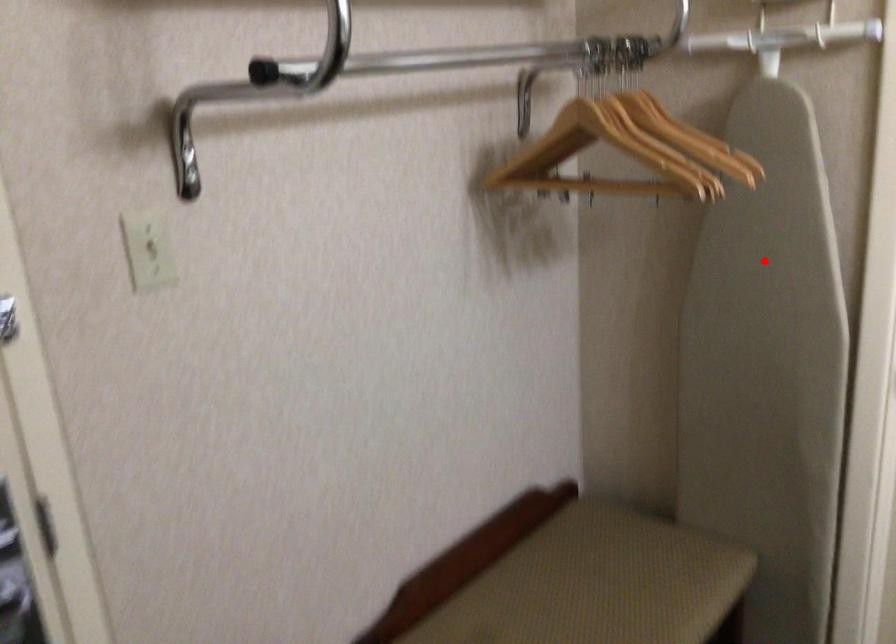
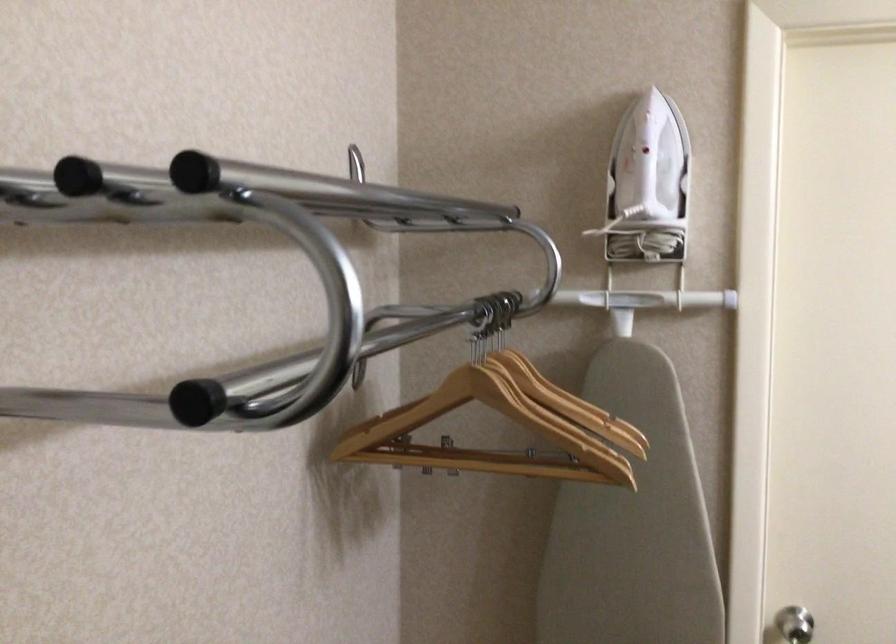
In the second image, find the point that corresponds to the highlighted location in the first image.

(633, 525)